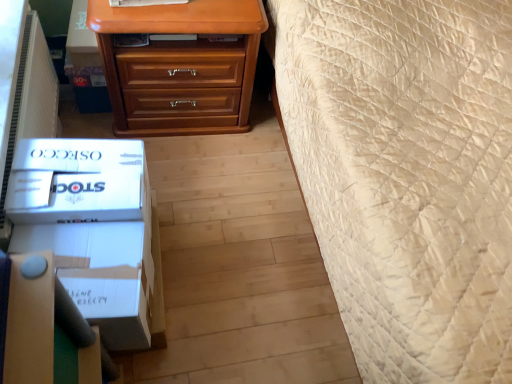
Question: Is point (103, 140) closer or farther from the camera than point (45, 210)?

Choices:
 (A) closer
 (B) farther

Answer: (B)

Question: From a real-world perspective, is white cardboard box at lower left, which is counted as the 2th box, starting from the bottom, physically located above or below white cardboard box at lower left, positioned as the 2th box in top-to-bottom order?

Choices:
 (A) above
 (B) below

Answer: (A)

Question: Which is nearer to the white cardboard box at lower left, positioned as the 2th box in top-to-bottom order?

Choices:
 (A) white cardboard box at lower left, which is the first box in top-to-bottom order
 (B) matte wood chest of drawers at upper center

Answer: (A)

Question: Which object is positioned closest to the matte wood chest of drawers at upper center?

Choices:
 (A) white cardboard box at lower left, which is the first box in top-to-bottom order
 (B) white cardboard box at lower left, positioned as the 2th box in top-to-bottom order

Answer: (A)